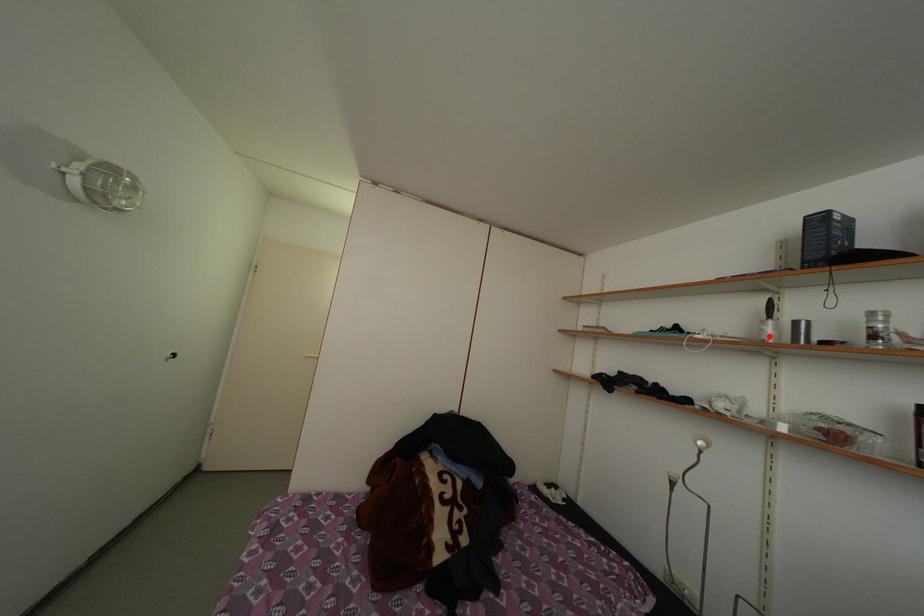
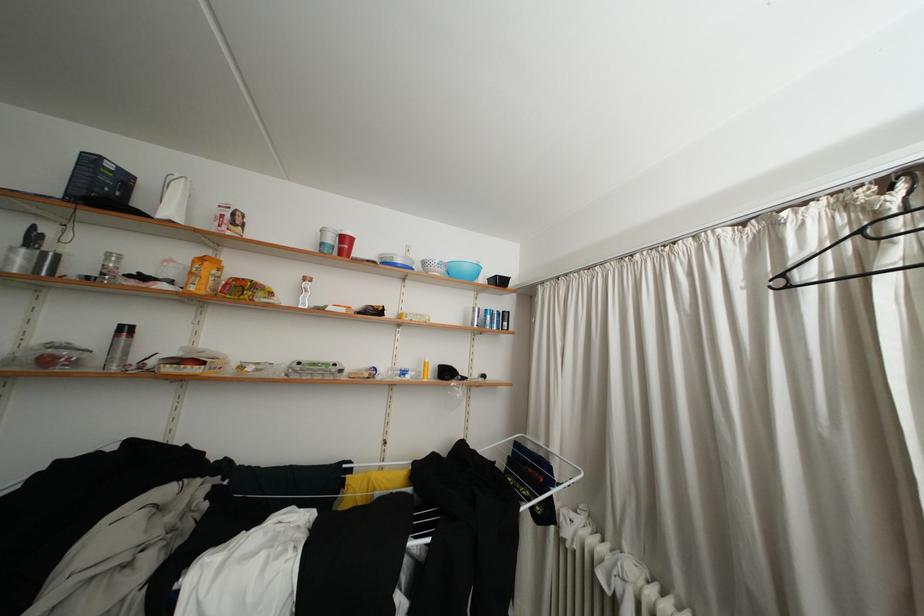
In the second image, find the point that corresponds to the highlighted location in the first image.

(17, 264)